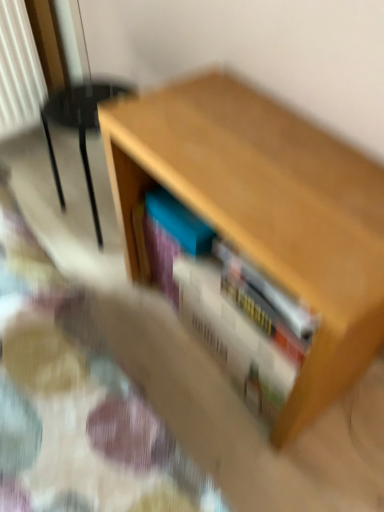
Locate an element on the screen. white matte book at center is located at coordinates (226, 303).

What do you see at coordinates (179, 222) in the screenshot?
I see `blue matte book at center` at bounding box center [179, 222].

This screenshot has width=384, height=512. Find the location of `white matte book at center`. white matte book at center is located at coordinates (226, 303).

From a real-world perspective, is white matte book at center positioned above or below blue matte book at center?

white matte book at center is below blue matte book at center.

Is point (289, 374) farther from viewer compared to point (160, 189)?

No, (289, 374) is in front of (160, 189).

Is white matte book at center turned away from blue matte book at center?

white matte book at center is not turned away from blue matte book at center.

Is white matte book at center in contact with blue matte book at center?

They are not placed beside each other.

You are a GUI agent. You are given a task and a screenshot of the screen. Output one action in this format:
    pyautogui.click(x=<x>, y=<y>)
    Task: Click on the table on the left of the white matte book at center
    The width and height of the screenshot is (384, 512).
    Given the screenshot: What is the action you would take?
    pyautogui.click(x=265, y=211)

From the image's perspective, is wooden table at center above white matte book at center?

Yes.

How much distance is there between wooden table at center and white matte book at center?

wooden table at center and white matte book at center are 6.61 inches apart.

Is blue matte book at center taller or shorter than white matte book at center?

Considering their sizes, blue matte book at center has less height than white matte book at center.

From a real-world perspective, which is physically above, blue matte book at center or white matte book at center?

blue matte book at center.

Which object is positioned more to the right, blue matte book at center or white matte book at center?

From the viewer's perspective, white matte book at center appears more on the right side.

Does blue matte book at center contain white matte book at center?

No, white matte book at center is located outside of blue matte book at center.

Based on their positions, is wooden table at center located to the left or right of blue matte book at center?

In the image, wooden table at center appears on the right side of blue matte book at center.

Does wooden table at center lie behind blue matte book at center?

No, wooden table at center is in front of blue matte book at center.

Are wooden table at center and blue matte book at center beside each other?

There is a gap between wooden table at center and blue matte book at center.

From the image's perspective, between wooden table at center and blue matte book at center, who is located below?

From the image's view, wooden table at center is below.

Is velvet beige armchair at left positioned far away from white matte book at center?

Actually, velvet beige armchair at left and white matte book at center are a little close together.

Which of these two, velvet beige armchair at left or white matte book at center, is smaller?

Smaller between the two is white matte book at center.

From a real-world perspective, which is physically above, velvet beige armchair at left or white matte book at center?

velvet beige armchair at left is physically above.

Considering the sizes of wooden table at center and velvet beige armchair at left in the image, is wooden table at center wider or thinner than velvet beige armchair at left?

In the image, wooden table at center appears to be wider than velvet beige armchair at left.

Is wooden table at center spatially inside velvet beige armchair at left, or outside of it?

wooden table at center exists outside the volume of velvet beige armchair at left.

Based on the photo, in the image, is wooden table at center on the left side or the right side of velvet beige armchair at left?

Clearly, wooden table at center is on the right of velvet beige armchair at left in the image.

Who is shorter, wooden table at center or velvet beige armchair at left?

velvet beige armchair at left.

Is velvet beige armchair at left oriented away from wooden table at center?

No, velvet beige armchair at left is not facing the opposite direction of wooden table at center.

From a real-world perspective, is velvet beige armchair at left beneath wooden table at center?

Yes, from a real-world perspective, velvet beige armchair at left is under wooden table at center.

Locate an element on the screen. table above the velvet beige armchair at left (from a real-world perspective) is located at coordinates (265, 211).

From the image's perspective, is velvet beige armchair at left on wooden table at center?

Yes, from the image's perspective, velvet beige armchair at left is on top of wooden table at center.

Identify the location of book in front of the blue matte book at center. (226, 303).

The image size is (384, 512). Identify the location of book lying on the right of wooden table at center. [226, 303].

When comparing their distances from blue matte book at center, does velvet beige armchair at left or wooden table at center seem further?

Among the two, velvet beige armchair at left is located further to blue matte book at center.

From the image, which object appears to be nearer to velvet beige armchair at left, wooden table at center or white matte book at center?

Based on the image, wooden table at center appears to be nearer to velvet beige armchair at left.

Based on their spatial positions, is blue matte book at center or white matte book at center closer to velvet beige armchair at left?

blue matte book at center is positioned closer to the anchor velvet beige armchair at left.

Estimate the real-world distances between objects in this image. Which object is further from white matte book at center, velvet beige armchair at left or blue matte book at center?

velvet beige armchair at left is further to white matte book at center.

Which object lies further to the anchor point white matte book at center, wooden table at center or velvet beige armchair at left?

Based on the image, velvet beige armchair at left appears to be further to white matte book at center.

Looking at the image, which one is located further to wooden table at center, white matte book at center or velvet beige armchair at left?

Based on the image, velvet beige armchair at left appears to be further to wooden table at center.

Looking at the image, which one is located further to white matte book at center, blue matte book at center or wooden table at center?

Among the two, wooden table at center is located further to white matte book at center.

Looking at the image, which one is located further to wooden table at center, velvet beige armchair at left or blue matte book at center?

velvet beige armchair at left is positioned further to the anchor wooden table at center.

You are a GUI agent. You are given a task and a screenshot of the screen. Output one action in this format:
    pyautogui.click(x=<x>, y=<y>)
    Task: Click on the book located between wooden table at center and velvet beige armchair at left in the depth direction
    The width and height of the screenshot is (384, 512).
    Given the screenshot: What is the action you would take?
    pyautogui.click(x=226, y=303)

Find the location of a particular element. This screenshot has width=384, height=512. paperback book between velvet beige armchair at left and white matte book at center in the vertical direction is located at coordinates (x=179, y=222).

At what (x,y) coordinates should I click in order to perform the action: click on paperback book positioned between wooden table at center and velvet beige armchair at left from near to far. Please return your answer as a coordinate pair (x, y). The width and height of the screenshot is (384, 512). Looking at the image, I should click on (179, 222).

Identify the location of book positioned between wooden table at center and blue matte book at center from near to far. (226, 303).